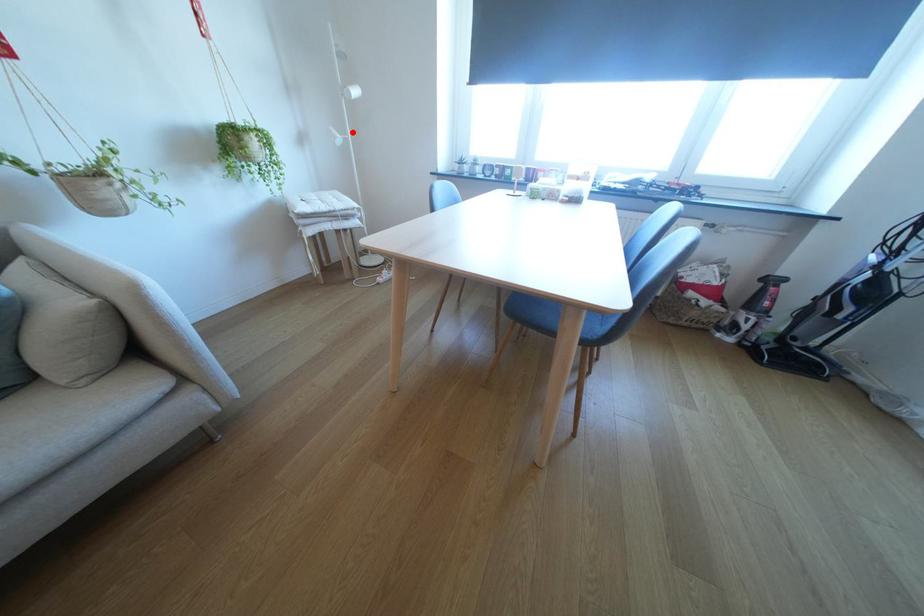
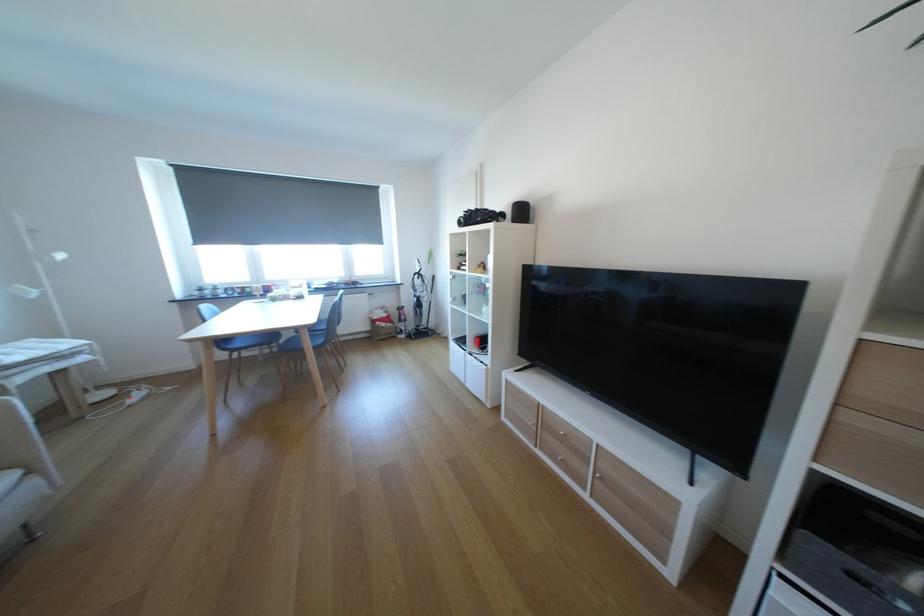
Locate, in the second image, the point that corresponds to the highlighted location in the first image.

(47, 286)